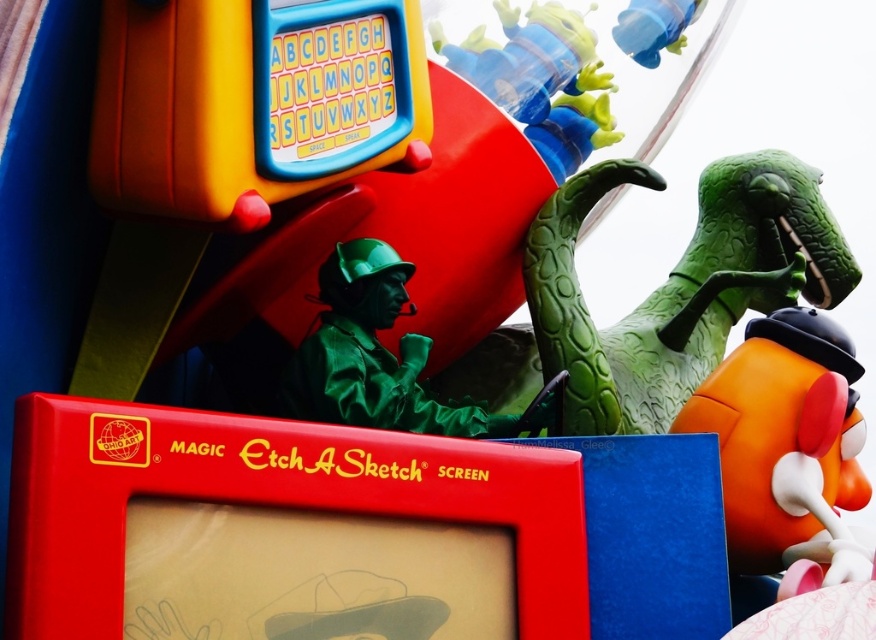
Question: Which object appears closest to the camera in this image?

Choices:
 (A) translucent blue figure at upper center
 (B) green rubber dinosaur at upper center

Answer: (B)

Question: Is green matte figure at center thinner than blue rubber duck at upper center?

Choices:
 (A) no
 (B) yes

Answer: (A)

Question: Based on their relative distances, which object is nearer to the orange matte mr potato head at right?

Choices:
 (A) blue rubber duck at upper center
 (B) green matte figure at center

Answer: (B)

Question: Considering the real-world distances, which object is closest to the blue rubber duck at upper center?

Choices:
 (A) translucent blue figure at upper center
 (B) green rubber dinosaur at upper center
 (C) green matte figure at center
 (D) orange matte mr potato head at right

Answer: (A)

Question: Can you confirm if green rubber dinosaur at upper center is thinner than orange matte mr potato head at right?

Choices:
 (A) no
 (B) yes

Answer: (A)

Question: Where is green rubber dinosaur at upper center located in relation to orange matte mr potato head at right in the image?

Choices:
 (A) right
 (B) left

Answer: (B)